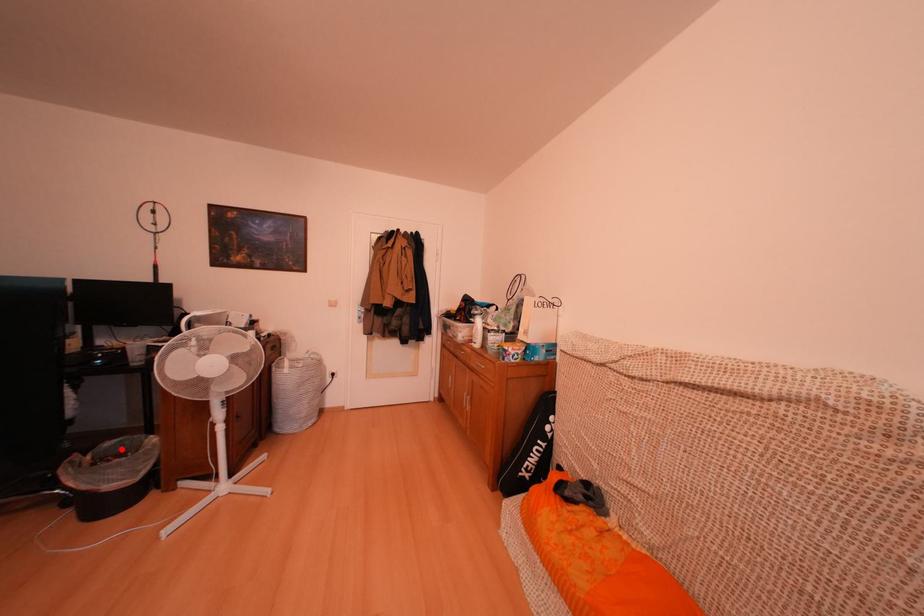
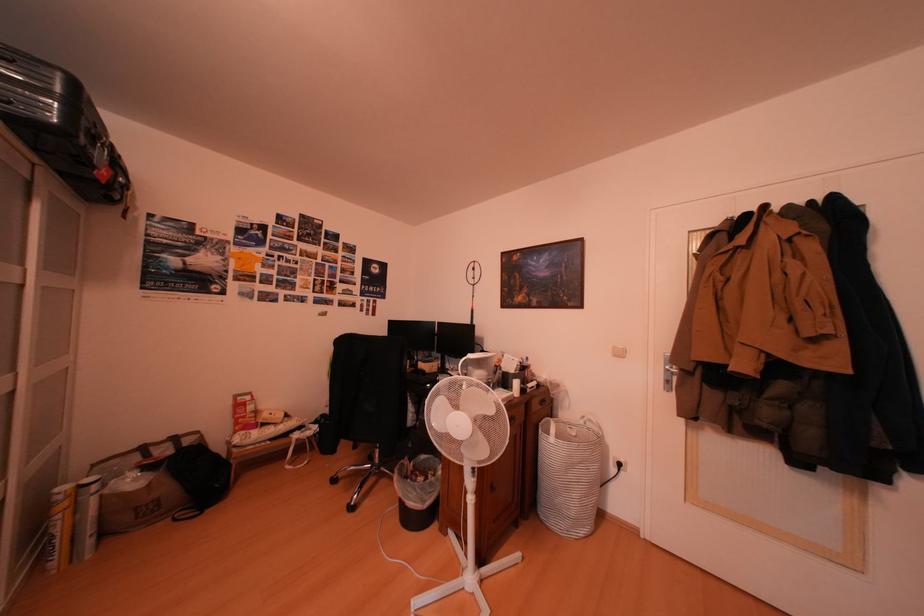
Question: I am providing you with two images of the same scene from different viewpoints. A red point is shown in image1. For the corresponding object point in image2, is it positioned nearer or farther from the camera?

Choices:
 (A) Nearer
 (B) Farther

Answer: (B)